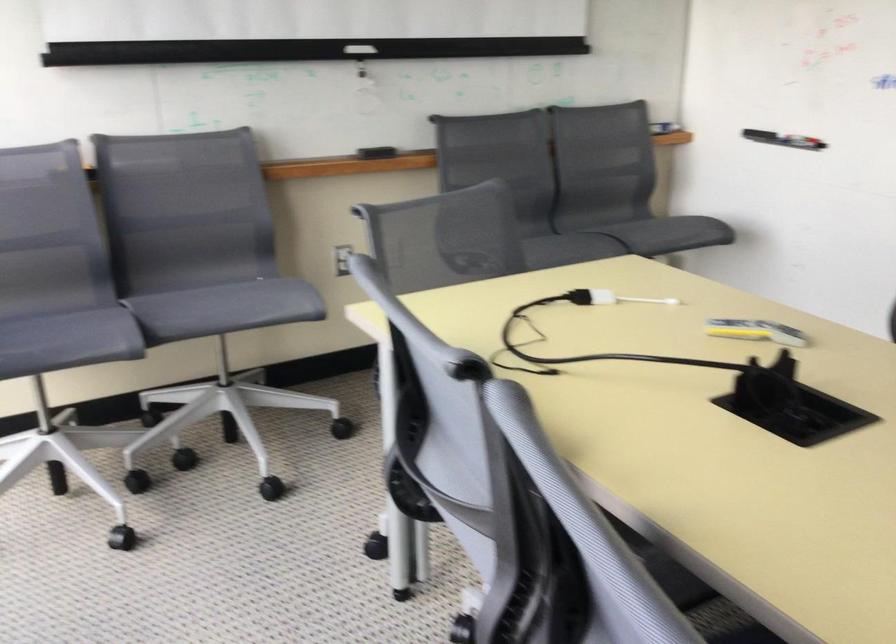
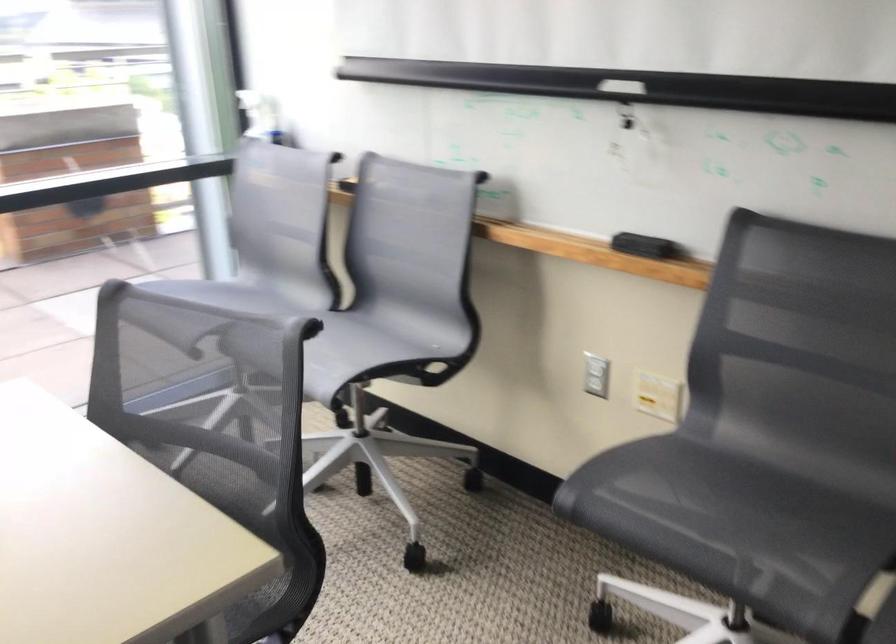
In the second image, find the point that corresponds to point (245, 290) in the first image.

(348, 351)